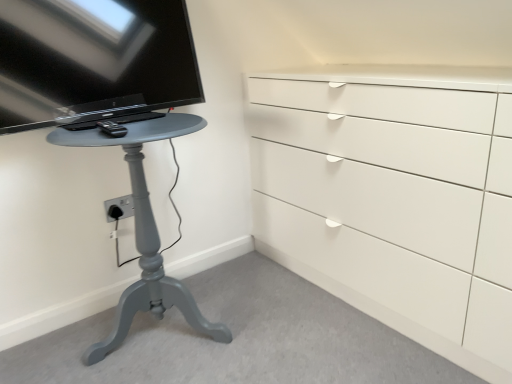
Image resolution: width=512 pixels, height=384 pixels. Find the location of `free point to the right of black plastic remote control at left`. free point to the right of black plastic remote control at left is located at coordinates (158, 122).